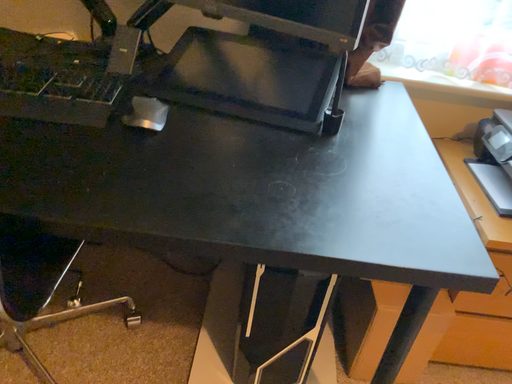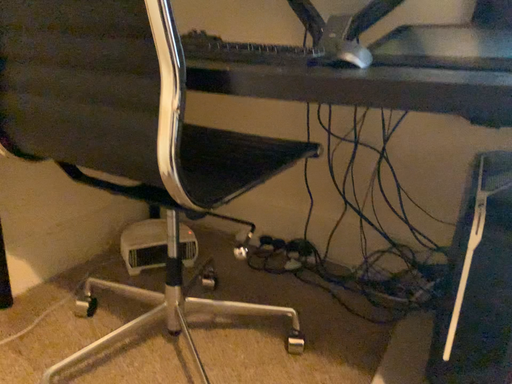
Question: Which way did the camera rotate in the video?

Choices:
 (A) rotated right
 (B) rotated left

Answer: (B)